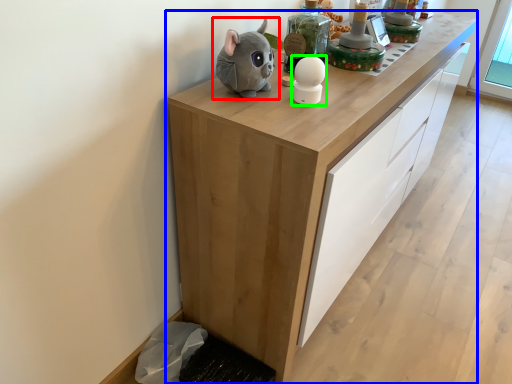
Question: Based on their relative distances, which object is farther from toy (highlighted by a red box)? Choose from cabinetry (highlighted by a blue box) and toy (highlighted by a green box).

Choices:
 (A) cabinetry
 (B) toy

Answer: (A)